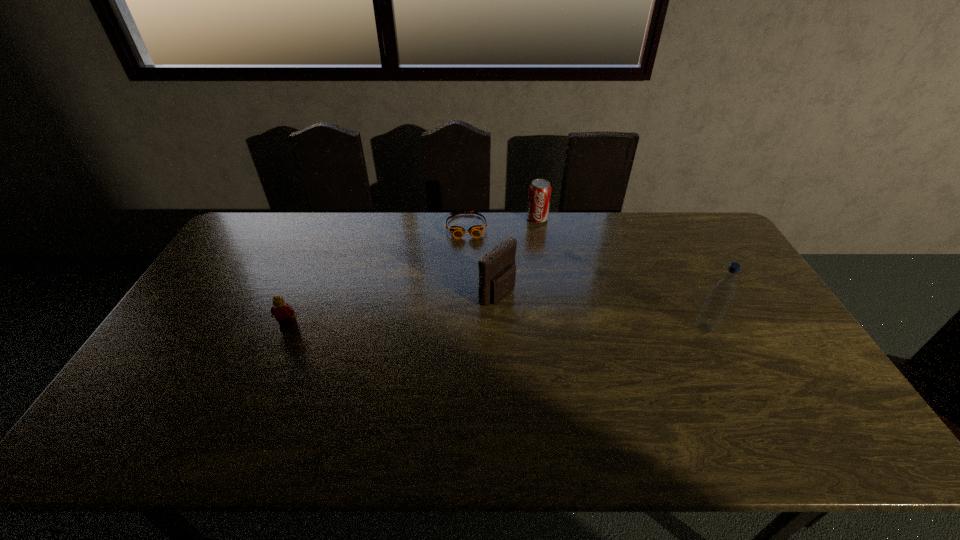
The height and width of the screenshot is (540, 960). What are the coordinates of `vacant position located with an open flap on the third nearest object` in the screenshot? It's located at tap(587, 347).

In order to click on vacant space located with an open flap on the third nearest object in this screenshot , I will do `click(539, 319)`.

Locate an element on the screen. The width and height of the screenshot is (960, 540). vacant space located 0.290m with an open flap on the third nearest object is located at coordinates (596, 353).

Find the location of a particular element. This screenshot has height=540, width=960. vacant space located with the lenses facing forward on the goggles is located at coordinates (468, 253).

Locate an element on the screen. This screenshot has height=540, width=960. free spot located with the lenses facing forward on the goggles is located at coordinates (470, 276).

The width and height of the screenshot is (960, 540). Find the location of `free space located 0.050m with the lenses facing forward on the goggles`. free space located 0.050m with the lenses facing forward on the goggles is located at coordinates (468, 249).

Image resolution: width=960 pixels, height=540 pixels. I want to click on vacant space located on the logo side of the soda can, so click(537, 238).

Where is `free location located on the logo side of the soda can`? free location located on the logo side of the soda can is located at coordinates (535, 281).

Image resolution: width=960 pixels, height=540 pixels. I want to click on free spot located on the logo side of the soda can, so click(x=534, y=296).

This screenshot has width=960, height=540. Find the location of `goggles at the far edge`. goggles at the far edge is located at coordinates click(457, 232).